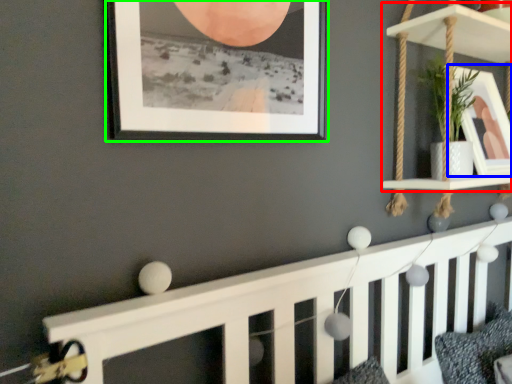
Question: Estimate the real-world distances between objects in this image. Which object is closer to shelf (highlighted by a red box), picture frame (highlighted by a blue box) or picture frame (highlighted by a green box)?

Choices:
 (A) picture frame
 (B) picture frame

Answer: (A)